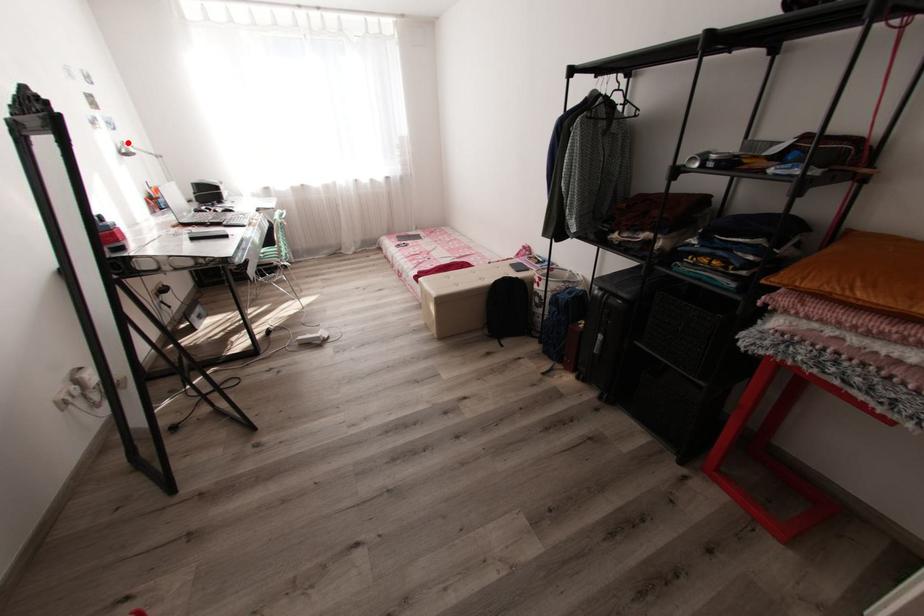
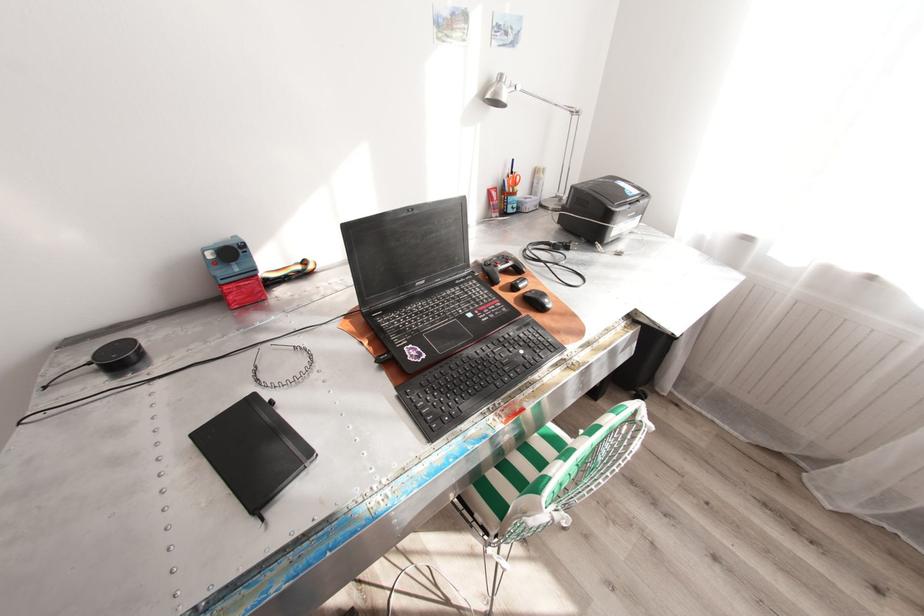
Find the pixel in the second image that matches the highlighted location in the first image.

(505, 76)